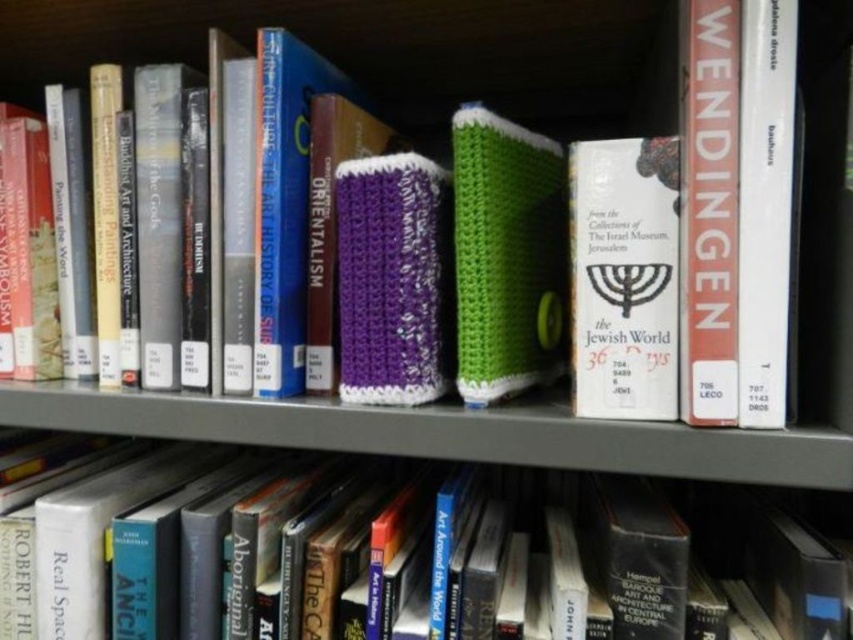
You are standing in front of the bookshelf and want to place a new book between the two points, point (628,614) and point (515,333). Which point should you place the book closer to in order to ensure it is placed in front of the existing items?

You should place the new book closer to point (628,614) because it is closer to the viewer than point (515,333), so placing the book there would position it in front of the existing items.

You are organizing a bookshelf and need to place a new book that is 15 cm wide. You see the hardcover book at center and the white paper book at center. Which book should you choose to place the new book next to if you want to ensure there is enough space?

The hardcover book at center has a greater width than the white paper book at center. Therefore, placing the new book next to the hardcover book at center would provide more space.

You are organizing the bookshelf and need to place a new book between the hardcover book at center and the green knitted book at center. Based on their positions, which side should the new book be placed on?

The hardcover book at center is to the left of the green knitted book at center, so the new book should be placed between them on the right side of the hardcover book at center and the left side of the green knitted book at center.